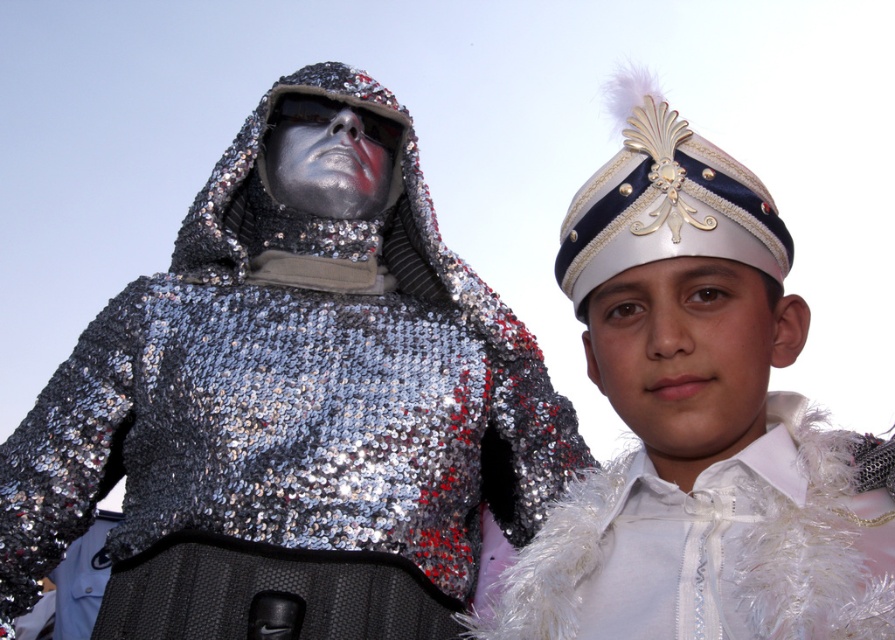
Question: Which point appears closest to the camera in this image?

Choices:
 (A) (14, 499)
 (B) (608, 172)
 (C) (701, 497)

Answer: (C)

Question: Which object is positioned farthest from the white feathered hat at upper right?

Choices:
 (A) white satin headdress at upper right
 (B) shiny metallic armor at left

Answer: (B)

Question: Does shiny metallic armor at left lie in front of white feathered hat at upper right?

Choices:
 (A) no
 (B) yes

Answer: (A)

Question: In this image, where is shiny metallic armor at left located relative to white feathered hat at upper right?

Choices:
 (A) right
 (B) left

Answer: (B)

Question: Among these points, which one is nearest to the camera?

Choices:
 (A) (722, 627)
 (B) (632, 236)
 (C) (16, 458)

Answer: (A)

Question: Is shiny metallic armor at left to the right of white satin headdress at upper right from the viewer's perspective?

Choices:
 (A) yes
 (B) no

Answer: (B)